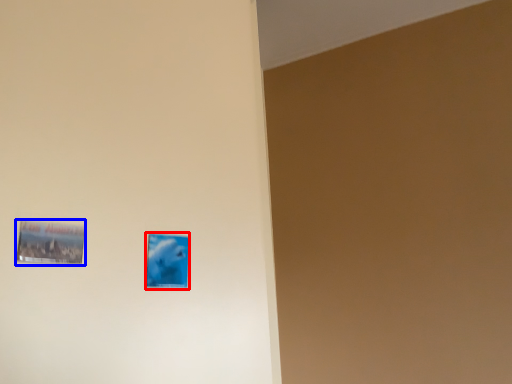
Question: Which object is further to the camera taking this photo, picture frame (highlighted by a red box) or picture frame (highlighted by a blue box)?

Choices:
 (A) picture frame
 (B) picture frame

Answer: (A)